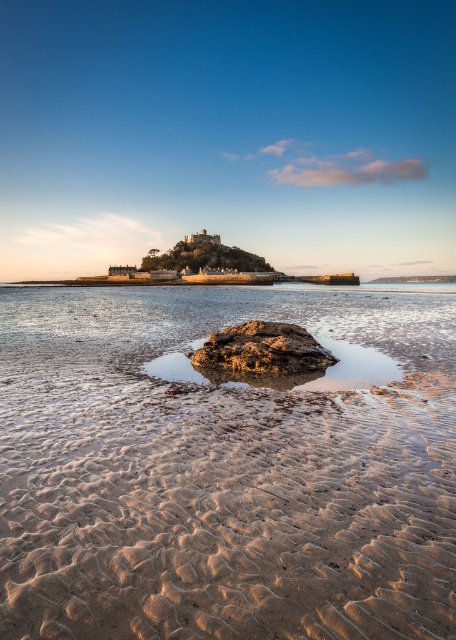
You are standing on the beach and want to place a small flag exactly between the smooth sand at lower center and the rusty metallic rock at center. According to the scene description, where should you place the flag?

The smooth sand at lower center is below the rusty metallic rock at center, so the flag should be placed between them, closer to the smooth sand at lower center since it is positioned underneath the rock.

You are standing at the beach looking at the scene. There are two points marked in the image, one at coordinates point (120, 612) and another at point (320, 356). Which point is closer to you?

Point (120, 612) is closer to you than point (320, 356).